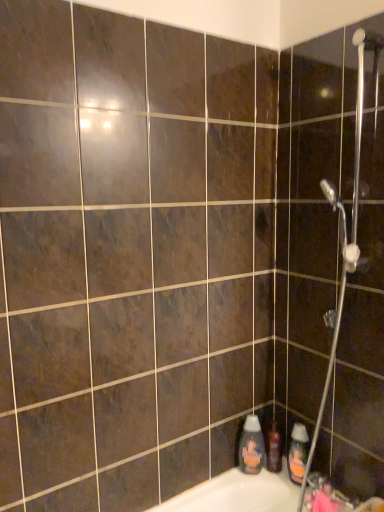
Question: Is translucent plastic bottle at lower right, which is the 1th cleaning product in left-to-right order, surrounded by orange matte bottle at lower right, the second cleaning product in the left-to-right sequence?

Choices:
 (A) no
 (B) yes

Answer: (A)

Question: Is orange matte bottle at lower right, the second cleaning product in the left-to-right sequence, positioned behind translucent plastic bottle at lower right, the second cleaning product viewed from the right?

Choices:
 (A) no
 (B) yes

Answer: (A)

Question: Can you confirm if orange matte bottle at lower right, the second cleaning product in the left-to-right sequence, is wider than translucent plastic bottle at lower right, the second cleaning product viewed from the right?

Choices:
 (A) no
 (B) yes

Answer: (B)

Question: Considering the relative sizes of orange matte bottle at lower right, placed as the first cleaning product when sorted from right to left, and translucent plastic bottle at lower right, which is the 1th cleaning product in left-to-right order, in the image provided, is orange matte bottle at lower right, placed as the first cleaning product when sorted from right to left, bigger than translucent plastic bottle at lower right, which is the 1th cleaning product in left-to-right order,?

Choices:
 (A) no
 (B) yes

Answer: (B)

Question: Can you confirm if orange matte bottle at lower right, placed as the first cleaning product when sorted from right to left, is thinner than translucent plastic bottle at lower right, which is the 1th cleaning product in left-to-right order?

Choices:
 (A) no
 (B) yes

Answer: (A)

Question: From a real-world perspective, is orange matte bottle at lower right, placed as the first cleaning product when sorted from right to left, below translucent plastic bottle at lower right, which is the 1th cleaning product in left-to-right order?

Choices:
 (A) no
 (B) yes

Answer: (B)

Question: Is translucent plastic shampoo bottle at lower right looking in the opposite direction of orange matte bottle at lower right, placed as the first cleaning product when sorted from right to left?

Choices:
 (A) no
 (B) yes

Answer: (A)

Question: From the image's perspective, is translucent plastic shampoo bottle at lower right on top of orange matte bottle at lower right, the second cleaning product in the left-to-right sequence?

Choices:
 (A) yes
 (B) no

Answer: (B)

Question: Does translucent plastic shampoo bottle at lower right have a larger size compared to orange matte bottle at lower right, placed as the first cleaning product when sorted from right to left?

Choices:
 (A) no
 (B) yes

Answer: (A)

Question: Is translucent plastic shampoo bottle at lower right outside of orange matte bottle at lower right, the second cleaning product in the left-to-right sequence?

Choices:
 (A) yes
 (B) no

Answer: (A)

Question: From a real-world perspective, is translucent plastic shampoo bottle at lower right physically above orange matte bottle at lower right, placed as the first cleaning product when sorted from right to left?

Choices:
 (A) yes
 (B) no

Answer: (B)

Question: Is translucent plastic shampoo bottle at lower right to the left of orange matte bottle at lower right, placed as the first cleaning product when sorted from right to left, from the viewer's perspective?

Choices:
 (A) yes
 (B) no

Answer: (A)

Question: Would you say metallic silver faucet at lower right is a long distance from orange matte bottle at lower right, placed as the first cleaning product when sorted from right to left?

Choices:
 (A) yes
 (B) no

Answer: (B)